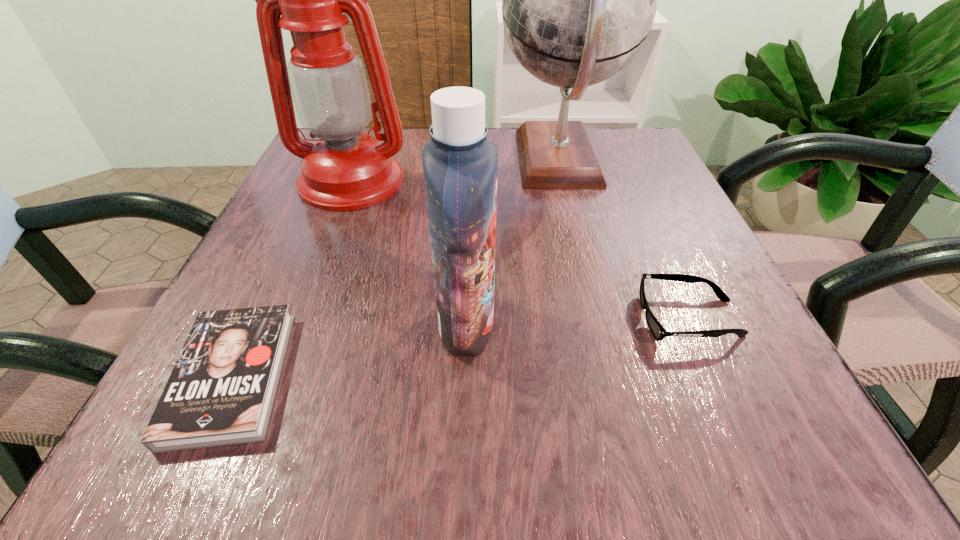
Where is `globe positioned at the right edge`? globe positioned at the right edge is located at coordinates (579, 0).

The height and width of the screenshot is (540, 960). In order to click on sunglasses at the right edge in this screenshot , I will do `click(659, 333)`.

Where is `object at the far left corner`? The height and width of the screenshot is (540, 960). object at the far left corner is located at coordinates (344, 170).

You are a GUI agent. You are given a task and a screenshot of the screen. Output one action in this format:
    pyautogui.click(x=<x>, y=<y>)
    Task: Click on the object present at the near left corner
    
    Given the screenshot: What is the action you would take?
    pyautogui.click(x=221, y=391)

Find the location of a particular element. object that is at the far right corner is located at coordinates (579, 0).

At what (x,y) coordinates should I click in order to perform the action: click on vacant space at the far edge of the desktop. Please return your answer as a coordinate pair (x, y). Looking at the image, I should click on (514, 151).

You are a GUI agent. You are given a task and a screenshot of the screen. Output one action in this format:
    pyautogui.click(x=<x>, y=<y>)
    Task: Click on the free space at the near edge of the desktop
    This screenshot has height=540, width=960.
    Given the screenshot: What is the action you would take?
    pyautogui.click(x=514, y=428)

In the image, there is a desktop. At what (x,y) coordinates should I click in order to perform the action: click on blank space at the left edge. Please return your answer as a coordinate pair (x, y). Image resolution: width=960 pixels, height=540 pixels. Looking at the image, I should click on (277, 226).

I want to click on vacant area at the right edge, so click(628, 198).

The height and width of the screenshot is (540, 960). Find the location of `vacant area at the far right corner`. vacant area at the far right corner is located at coordinates (623, 130).